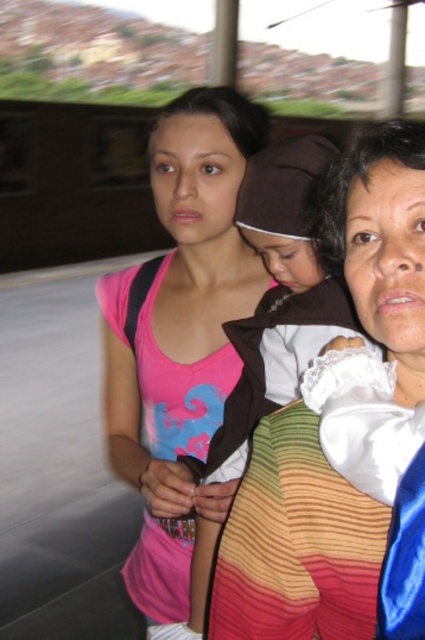
Does pink fabric at center have a lesser width compared to white lace baby at center?

No, pink fabric at center is not thinner than white lace baby at center.

Based on the photo, who is positioned more to the left, pink fabric at center or white lace baby at center?

pink fabric at center is more to the left.

Image resolution: width=425 pixels, height=640 pixels. I want to click on pink fabric at center, so click(x=180, y=330).